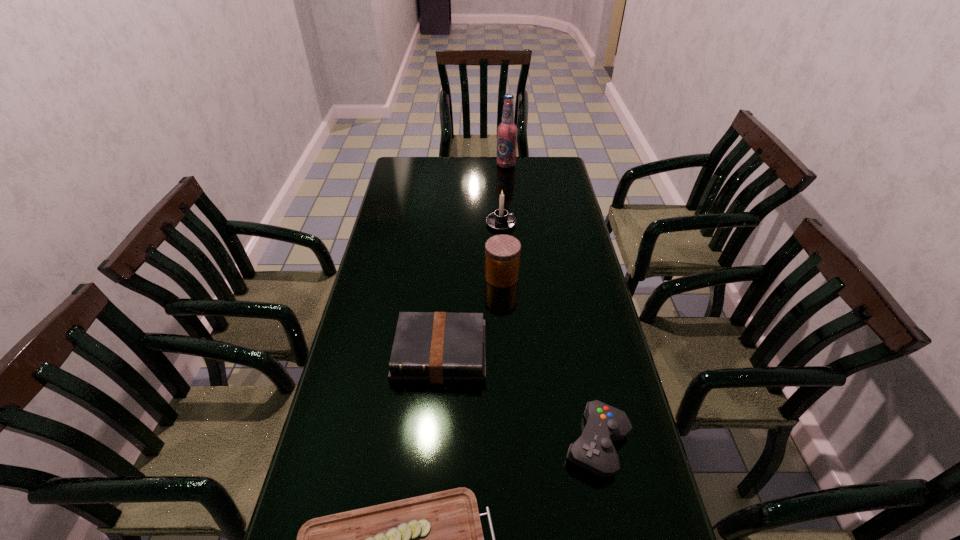
Locate an element on the screen. Image resolution: width=960 pixels, height=540 pixels. alcohol is located at coordinates (507, 131).

Image resolution: width=960 pixels, height=540 pixels. In order to click on the farthest object in this screenshot , I will do `click(507, 131)`.

Locate an element on the screen. This screenshot has height=540, width=960. the second farthest object is located at coordinates (501, 220).

Locate an element on the screen. The image size is (960, 540). jar is located at coordinates (502, 252).

Find the location of a particular element. the fourth farthest object is located at coordinates coord(429,347).

Where is `the rightmost object`? the rightmost object is located at coordinates (594, 451).

Locate an element on the screen. This screenshot has width=960, height=540. the fifth farthest object is located at coordinates (594, 451).

The image size is (960, 540). I want to click on vacant region located on the right of the farthest object, so click(529, 165).

Where is `vacant point located with a handle on the side of the candle holder`? The height and width of the screenshot is (540, 960). vacant point located with a handle on the side of the candle holder is located at coordinates (534, 224).

What are the coordinates of `vacant space located 0.200m on the front of the third farthest object` in the screenshot? It's located at (505, 335).